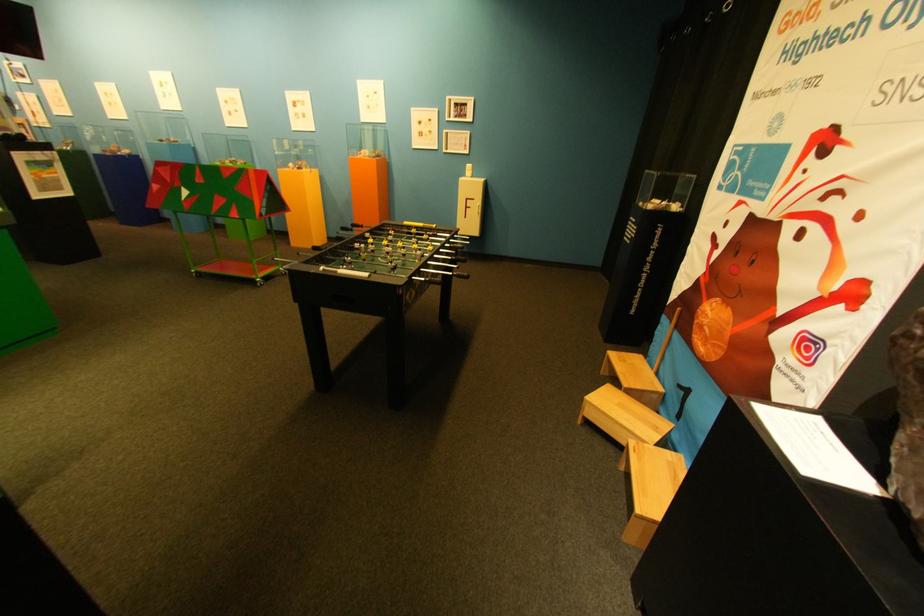
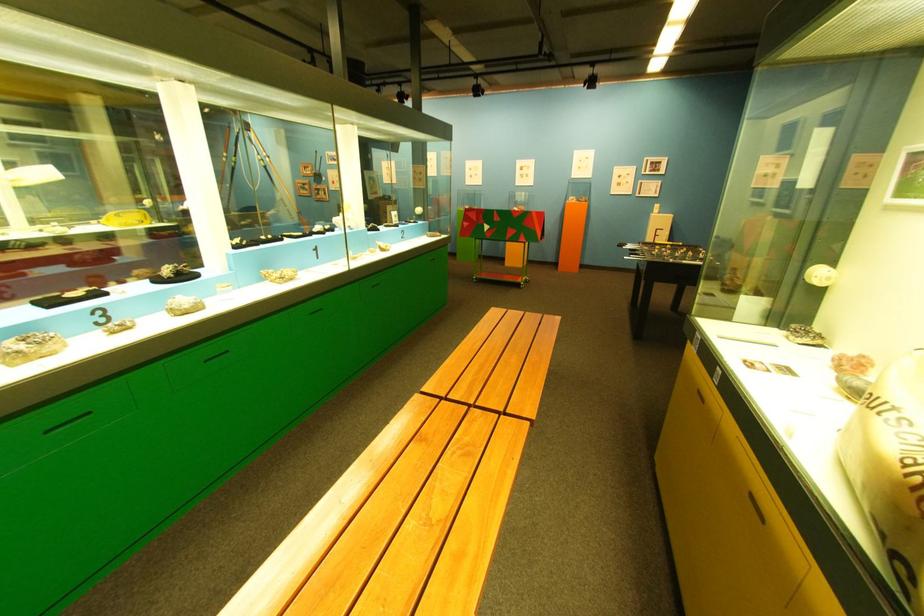
Find the pixel in the second image that matches point (213, 274) in the first image.

(492, 281)